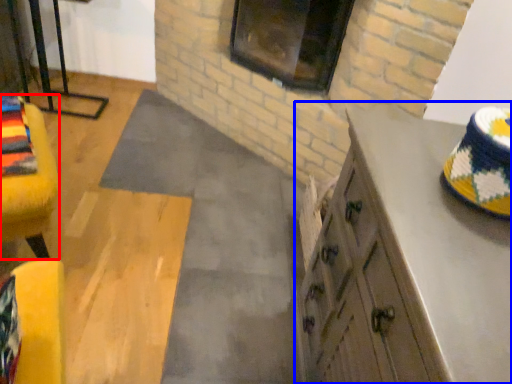
Question: Among these objects, which one is nearest to the camera, furniture (highlighted by a red box) or cabinetry (highlighted by a blue box)?

Choices:
 (A) furniture
 (B) cabinetry

Answer: (B)